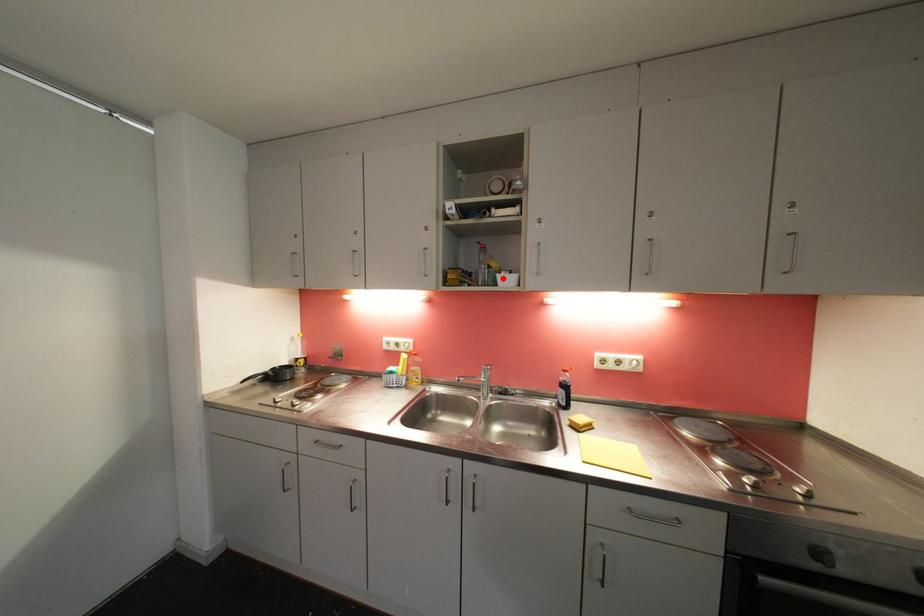
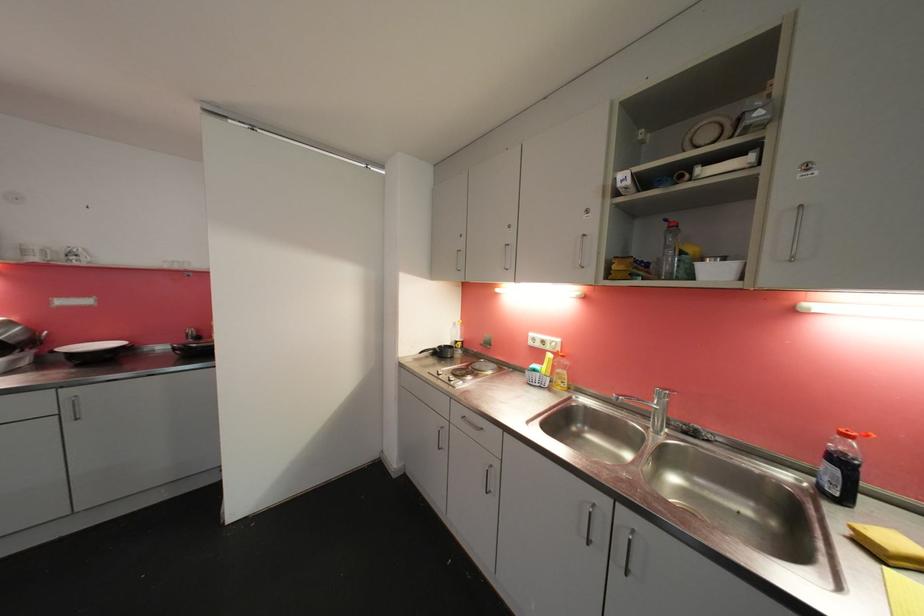
In the second image, find the point that corresponds to the highlighted location in the first image.

(703, 267)